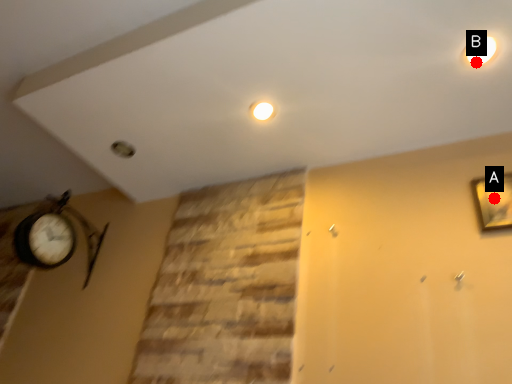
Question: Two points are circled on the image, labeled by A and B beside each circle. Among these points, which one is nearest to the camera?

Choices:
 (A) A is closer
 (B) B is closer

Answer: (B)